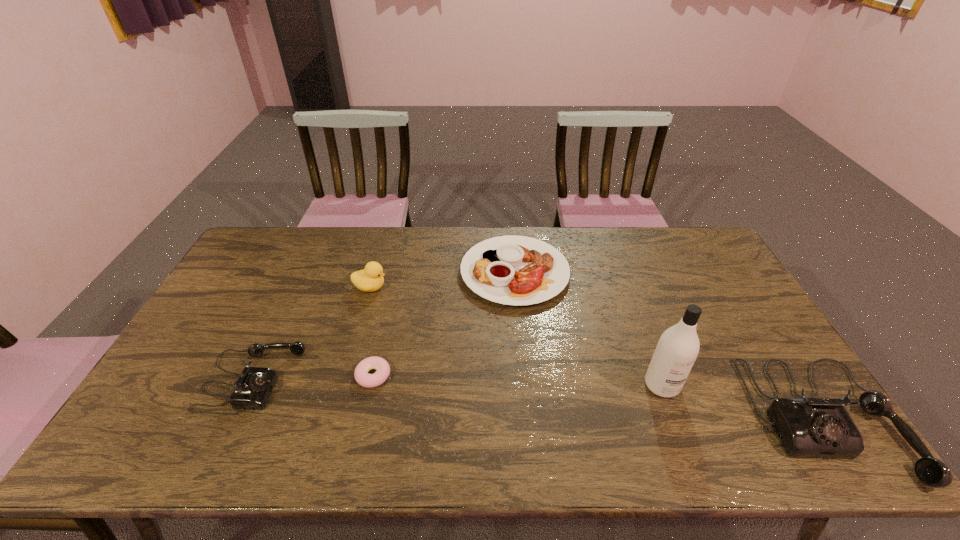
Locate an element on the screen. The width and height of the screenshot is (960, 540). vacant spot for a new telephone to ensure equal spacing is located at coordinates (527, 398).